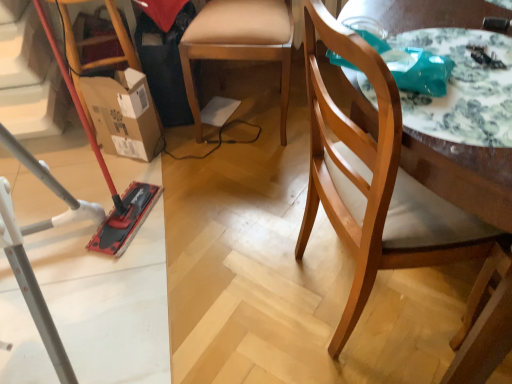
Question: Can you confirm if wooden chair at right, which is the first chair from front to back, is positioned to the right of white glossy table at upper right?

Choices:
 (A) no
 (B) yes

Answer: (A)

Question: Can you confirm if wooden chair at right, the 2th chair when ordered from back to front, is thinner than white glossy table at upper right?

Choices:
 (A) yes
 (B) no

Answer: (B)

Question: From the image's perspective, is wooden chair at right, which is the first chair from front to back, beneath white glossy table at upper right?

Choices:
 (A) yes
 (B) no

Answer: (A)

Question: From a real-world perspective, is wooden chair at right, the 2th chair when ordered from back to front, physically below white glossy table at upper right?

Choices:
 (A) no
 (B) yes

Answer: (B)

Question: Is wooden chair at right, which is the first chair from front to back, aimed at white glossy table at upper right?

Choices:
 (A) no
 (B) yes

Answer: (A)

Question: Considering the positions of wooden chair at right, which is the first chair from front to back, and cardboard box at left in the image, is wooden chair at right, which is the first chair from front to back, wider or thinner than cardboard box at left?

Choices:
 (A) wide
 (B) thin

Answer: (A)

Question: Relative to cardboard box at left, is wooden chair at right, the 2th chair when ordered from back to front, in front or behind?

Choices:
 (A) behind
 (B) front

Answer: (B)

Question: Is wooden chair at right, which is the first chair from front to back, spatially inside cardboard box at left, or outside of it?

Choices:
 (A) inside
 (B) outside

Answer: (B)

Question: Considering the positions of wooden chair at right, the 2th chair when ordered from back to front, and cardboard box at left in the image, is wooden chair at right, the 2th chair when ordered from back to front, bigger or smaller than cardboard box at left?

Choices:
 (A) small
 (B) big

Answer: (B)

Question: From the image's perspective, is cardboard box at left located above or below light brown wooden chair at center, arranged as the 1th chair when viewed from the back?

Choices:
 (A) below
 (B) above

Answer: (A)

Question: In the image, is cardboard box at left on the left side or the right side of light brown wooden chair at center, the 2th chair in the front-to-back sequence?

Choices:
 (A) right
 (B) left

Answer: (B)

Question: Considering the positions of cardboard box at left and light brown wooden chair at center, arranged as the 1th chair when viewed from the back, in the image, is cardboard box at left taller or shorter than light brown wooden chair at center, arranged as the 1th chair when viewed from the back,?

Choices:
 (A) tall
 (B) short

Answer: (B)

Question: In the image, is cardboard box at left positioned in front of or behind light brown wooden chair at center, the 2th chair in the front-to-back sequence?

Choices:
 (A) front
 (B) behind

Answer: (B)

Question: From a real-world perspective, relative to brushed metal vacuum cleaner at left, is white glossy table at upper right vertically above or below?

Choices:
 (A) below
 (B) above

Answer: (B)

Question: Is white glossy table at upper right in front of or behind brushed metal vacuum cleaner at left in the image?

Choices:
 (A) behind
 (B) front

Answer: (B)